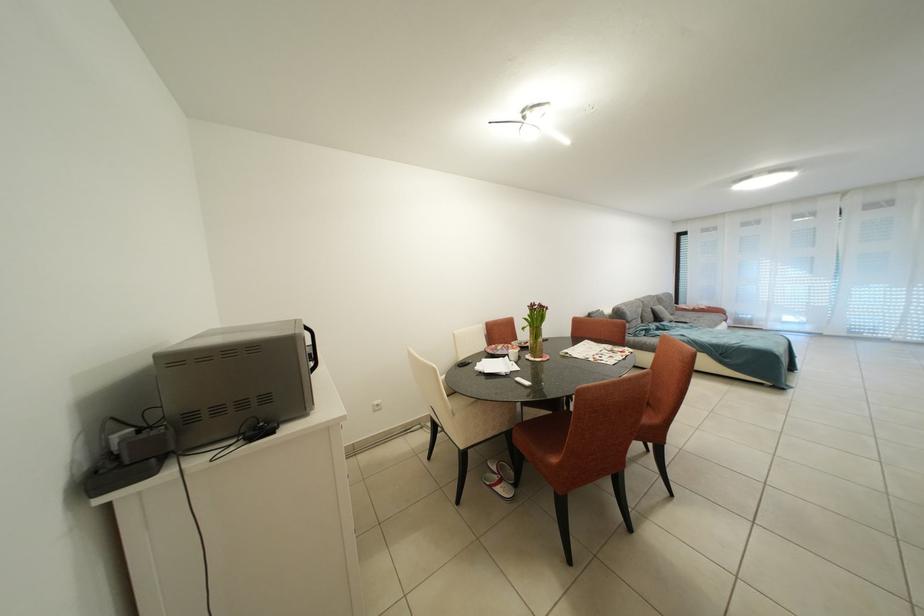
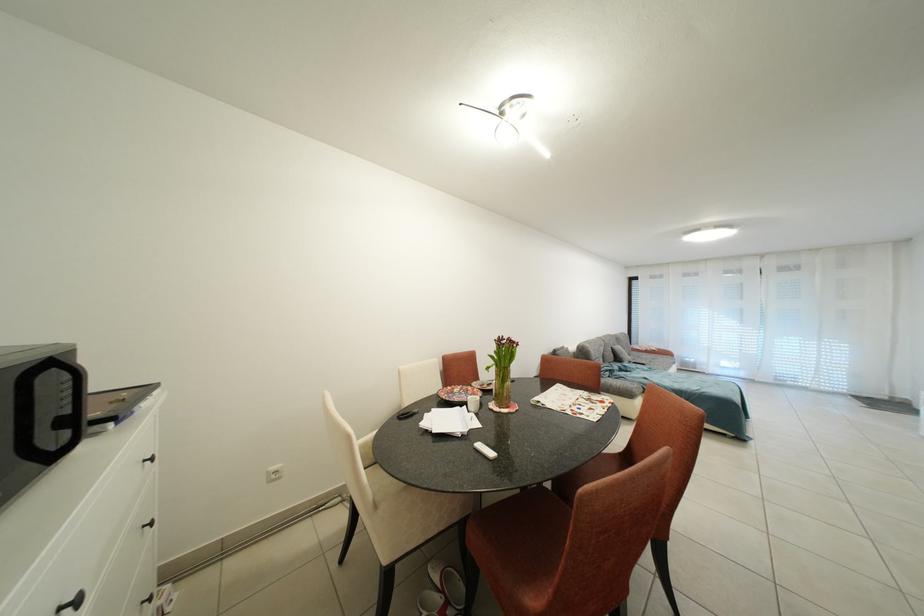
Question: The camera is either moving clockwise (left) or counter-clockwise (right) around the object. The first image is from the beginning of the video and the second image is from the end. Is the camera moving left or right when shooting the video?

Choices:
 (A) Left
 (B) Right

Answer: (A)